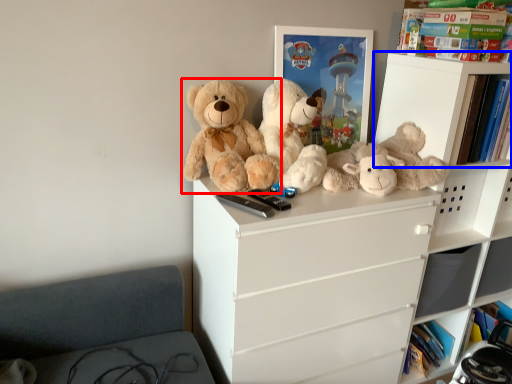
Question: Which point is further to the camera, teddy bear (highlighted by a red box) or shelf (highlighted by a blue box)?

Choices:
 (A) teddy bear
 (B) shelf

Answer: (B)